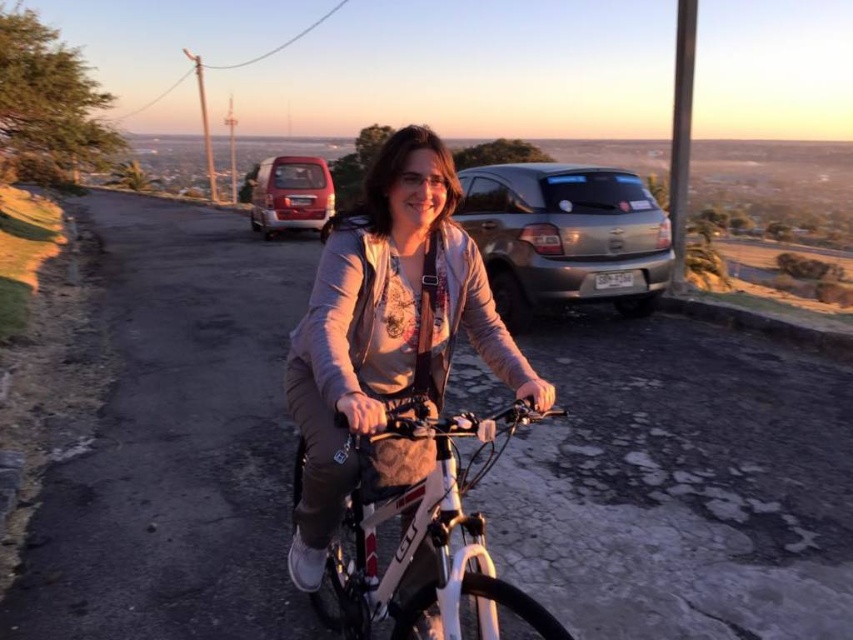
Question: Considering the relative positions of white matte bicycle at center and metallic red van at upper left in the image provided, where is white matte bicycle at center located with respect to metallic red van at upper left?

Choices:
 (A) above
 (B) below

Answer: (B)

Question: Can you confirm if matte gray jacket at center is bigger than metallic red van at upper left?

Choices:
 (A) yes
 (B) no

Answer: (B)

Question: Which point appears farthest from the camera in this image?

Choices:
 (A) (360, 436)
 (B) (318, 157)

Answer: (B)

Question: Which point is closer to the camera?

Choices:
 (A) white matte bicycle at center
 (B) metallic red van at upper left
 (C) matte gray jacket at center
 (D) satin silver suv at upper center

Answer: (A)

Question: Where is white matte bicycle at center located in relation to satin silver suv at upper center in the image?

Choices:
 (A) below
 (B) above

Answer: (A)

Question: Which point is farther from the camera taking this photo?

Choices:
 (A) (387, 429)
 (B) (367, 280)
 (C) (303, 212)

Answer: (C)